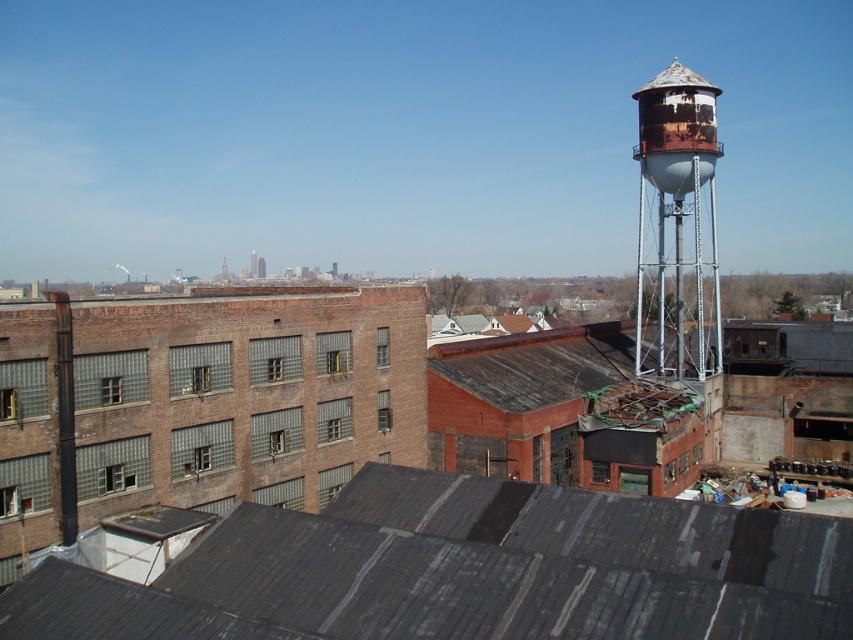
Measure the distance from dark gray corrugated metal roof at center to rusty metal water tower at upper right.

dark gray corrugated metal roof at center is 37.35 meters away from rusty metal water tower at upper right.

Which is more to the right, dark gray corrugated metal roof at center or rusty metal water tower at upper right?

rusty metal water tower at upper right is more to the right.

Which is in front, point (90, 596) or point (697, 172)?

Positioned in front is point (90, 596).

Locate an element on the screen. The height and width of the screenshot is (640, 853). dark gray corrugated metal roof at center is located at coordinates (456, 570).